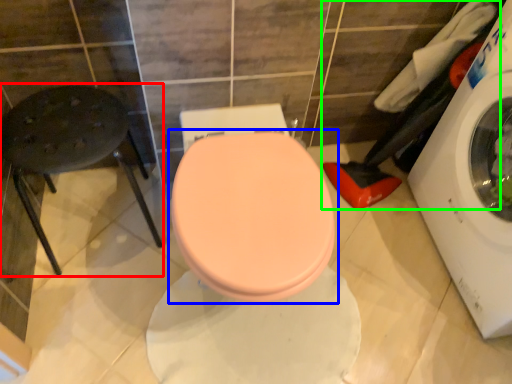
Question: Which is nearer to the bar stool (highlighted by a red box)? toilet (highlighted by a blue box) or laundry (highlighted by a green box).

Choices:
 (A) toilet
 (B) laundry

Answer: (A)